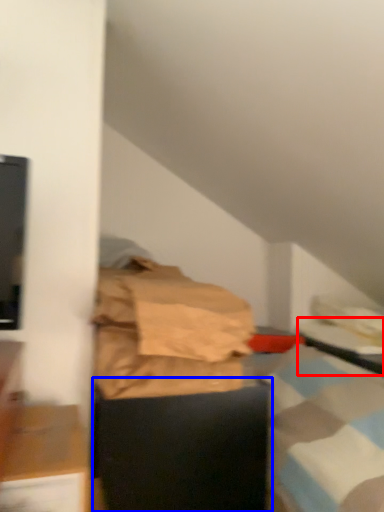
Question: Which object appears closest to the camera in this image, table (highlighted by a red box) or furniture (highlighted by a blue box)?

Choices:
 (A) table
 (B) furniture

Answer: (B)